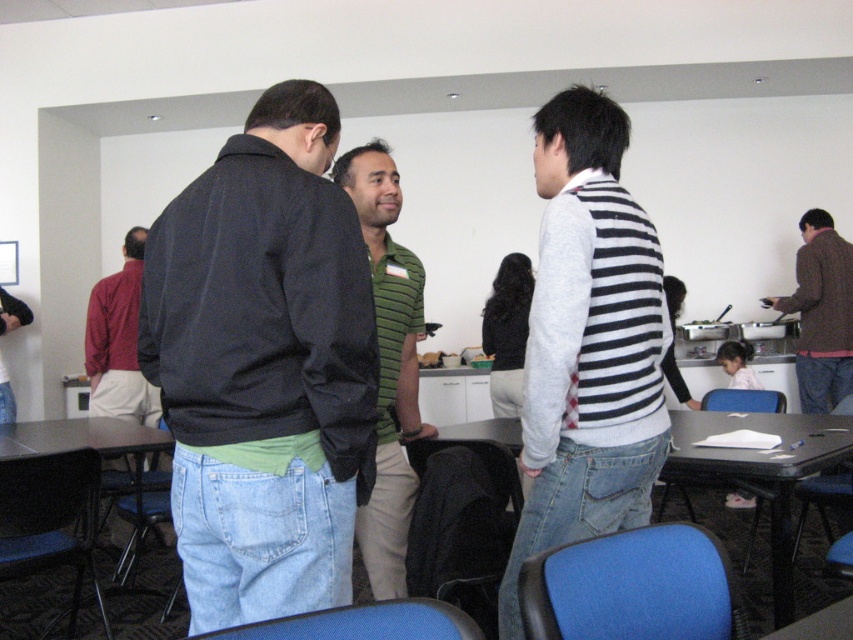
Who is shorter, green striped shirt at center or brown woolen sweater at right?

brown woolen sweater at right

Which is more to the right, green striped shirt at center or brown woolen sweater at right?

brown woolen sweater at right is more to the right.

Where is `green striped shirt at center`? green striped shirt at center is located at coordinates (387, 364).

Identify the location of green striped shirt at center. (387, 364).

Between point (593, 397) and point (850, 320), which one is positioned behind?

The point (850, 320) is more distant.

Based on the photo, can you confirm if striped sweater at center is thinner than brown woolen sweater at right?

Incorrect, striped sweater at center's width is not less than brown woolen sweater at right's.

Is point (643, 272) positioned before point (825, 236)?

That is True.

You are a GUI agent. You are given a task and a screenshot of the screen. Output one action in this format:
    pyautogui.click(x=<x>, y=<y>)
    Task: Click on the striped sweater at center
    
    Given the screenshot: What is the action you would take?
    pyautogui.click(x=589, y=342)

Can you confirm if green striped shirt at center is shorter than black plastic table at lower right?

No.

Between point (381, 534) and point (730, 477), which one is positioned behind?

The point (730, 477) is behind.

Where is `green striped shirt at center`? The image size is (853, 640). green striped shirt at center is located at coordinates (387, 364).